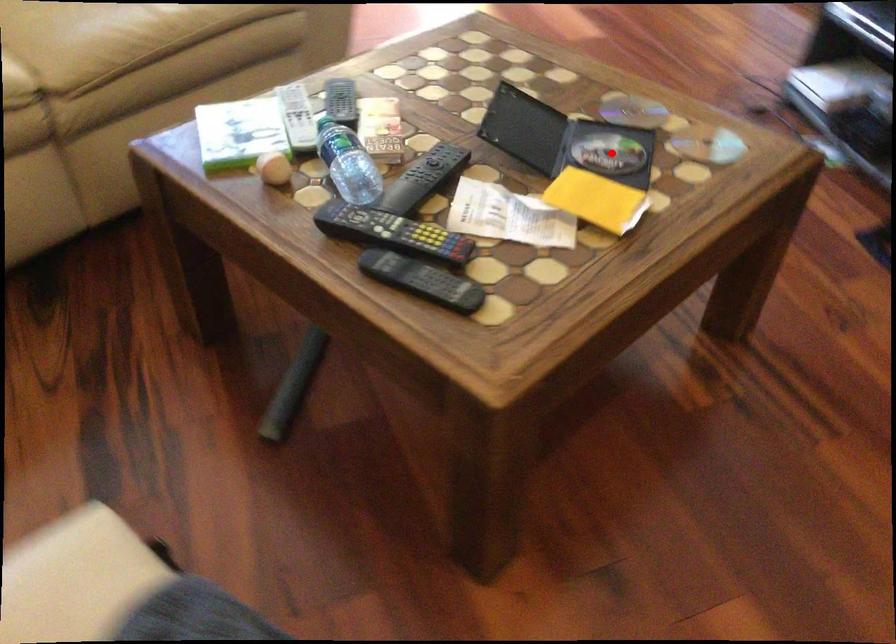
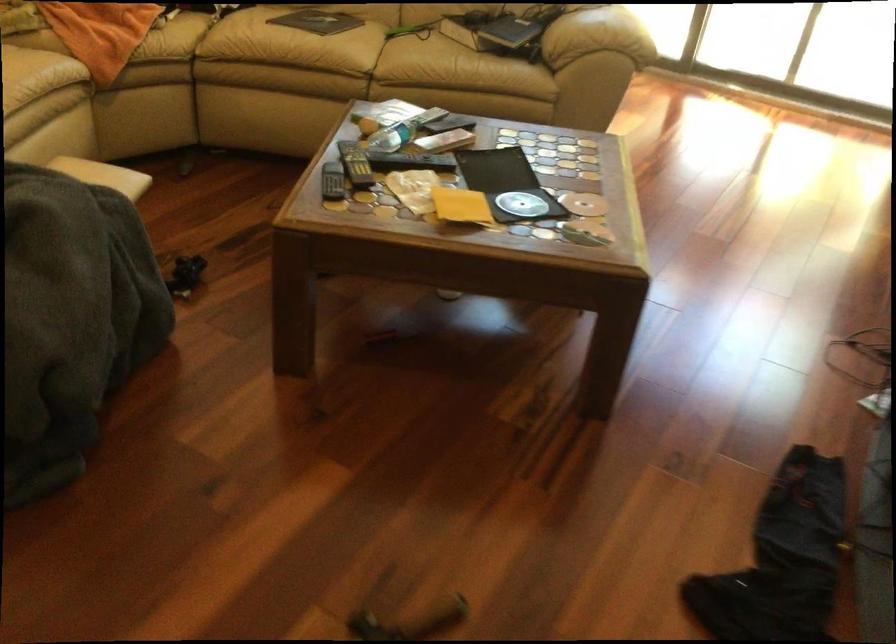
Question: I am providing you with two images of the same scene from different viewpoints. A red point is shown in image1. For the corresponding object point in image2, is it positioned nearer or farther from the camera?

Choices:
 (A) Nearer
 (B) Farther

Answer: (B)